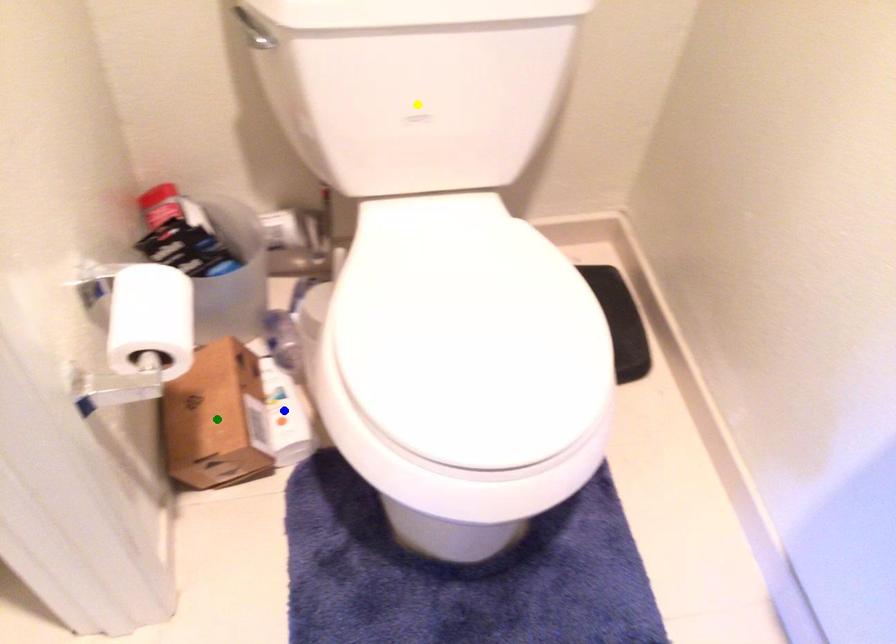
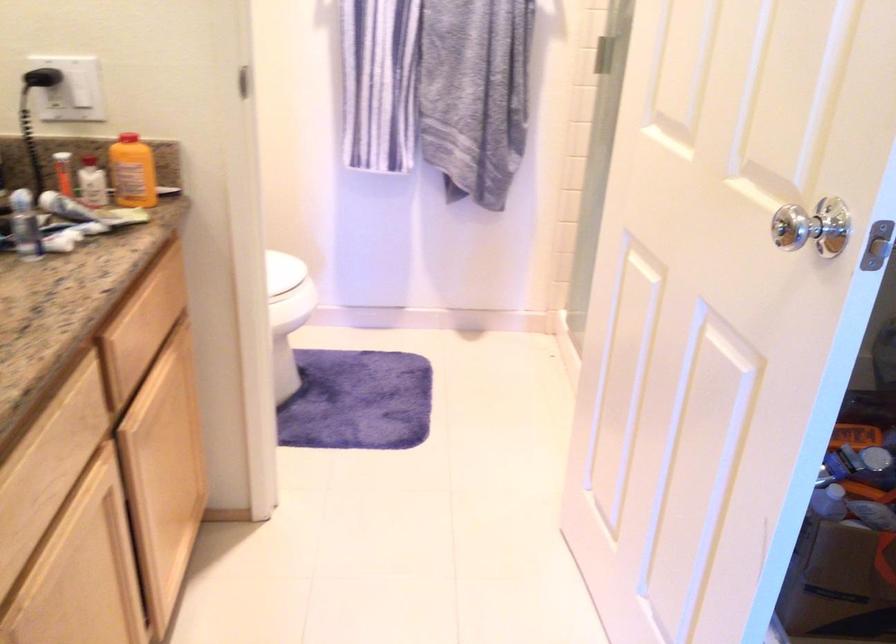
I am providing you with two images of the same scene from different viewpoints. Three points are marked in image1. Which point corresponds to a part or object that is occluded in image2?In image1, three points are marked. Which of them correspond to a part or object that is occluded in image2?Among the three points shown in image1, which one corresponds to a part or object that is no longer visible due to occlusion in image2?

blue point, yellow point, green point cannot be seen in image2.